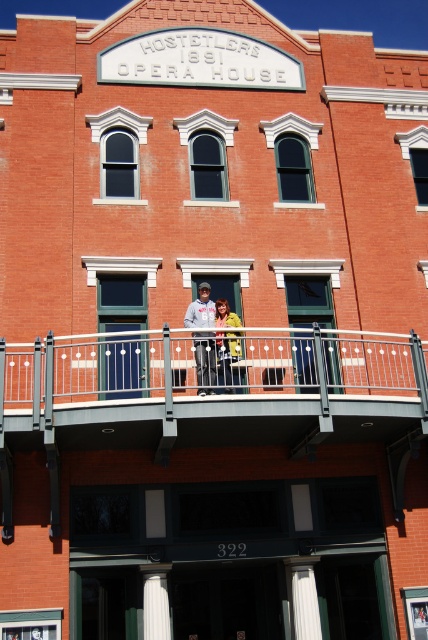
Question: Is metallic gray railing at upper center bigger than yellow matte jacket at center?

Choices:
 (A) no
 (B) yes

Answer: (B)

Question: Does matte gray hoodie at center appear on the right side of yellow matte jacket at center?

Choices:
 (A) no
 (B) yes

Answer: (A)

Question: Does white marble column at lower center have a lesser width compared to yellow matte jacket at center?

Choices:
 (A) yes
 (B) no

Answer: (B)

Question: Based on their relative distances, which object is farther from the metallic gray railing at upper center?

Choices:
 (A) matte gray hoodie at center
 (B) white marble column at lower center
 (C) yellow matte jacket at center

Answer: (B)

Question: Which point is farther to the camera?

Choices:
 (A) (229, 317)
 (B) (222, 323)

Answer: (A)

Question: Which object is positioned closest to the matte gray hoodie at center?

Choices:
 (A) yellow matte jacket at center
 (B) metallic gray railing at upper center
 (C) white marble column at lower center

Answer: (A)